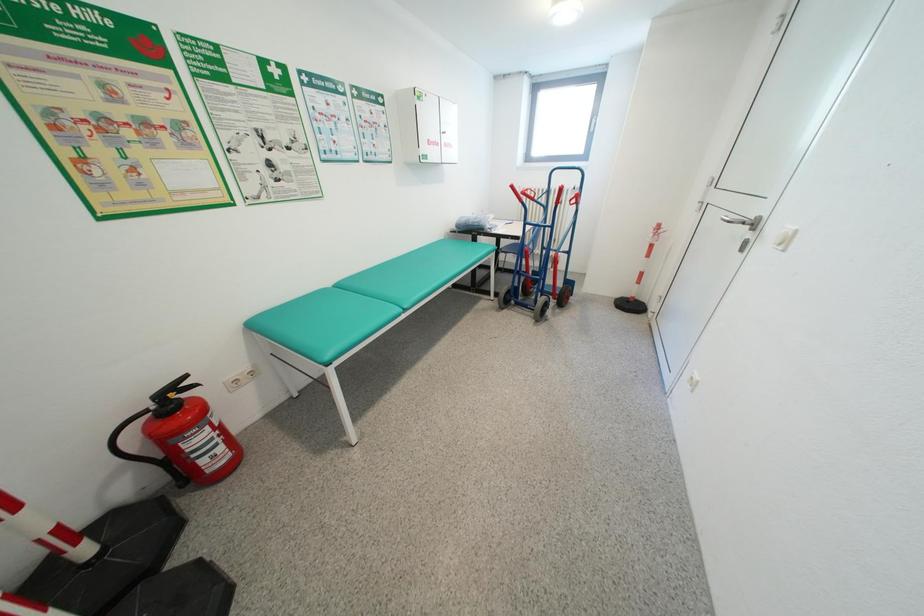
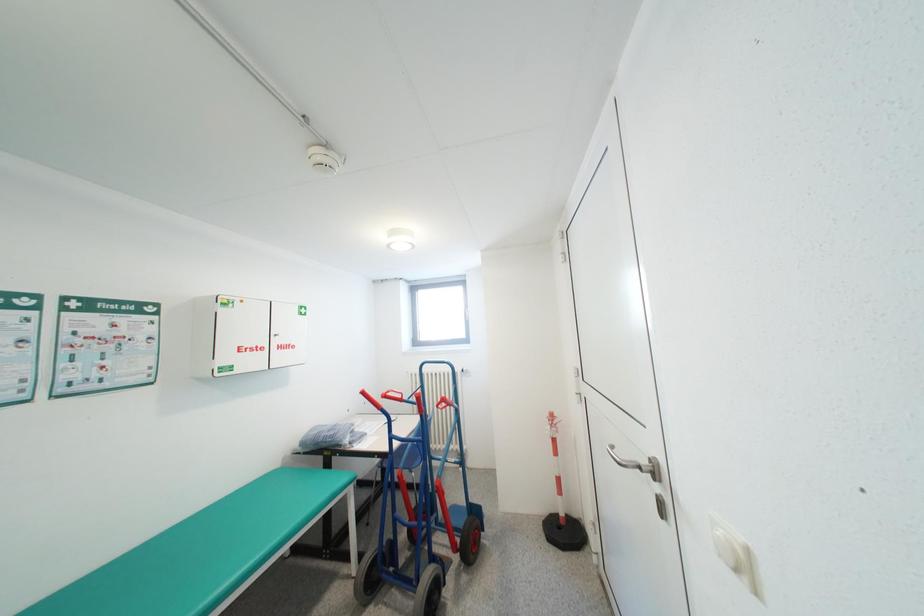
How did the camera likely rotate?

The rotation direction of the camera is right-up.